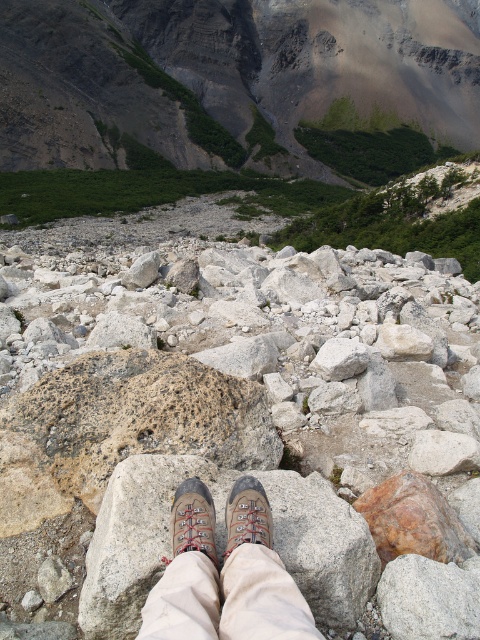
Based on the photo, you are a hiker trying to decide which footwear to wear for the rocky terrain ahead. You have two options in the image, the brown leather boots at center and the brown suede shoe at center. Based on their placement in the scene, which one is positioned to the right?

The brown leather boots at center are to the right of the brown suede shoe at center, so the brown leather boots at center is positioned to the right.

You are a hiker trying to take a photo of the rugged granite mountain at upper center. However, your brown suede shoe at center is blocking the view. Can you move your foot to the left to get a clear shot?

The brown suede shoe at center is behind the rugged granite mountain at upper center, so moving your foot to the left might not help because the shoe is already positioned behind the mountain. You might need to move your foot to the right to ensure it doesn not obstruct the view.

You are a hiker who wants to place your brown suede shoe at center on top of the speckled rock at center. Based on their sizes, will the shoe fit stably on the rock?

The speckled rock at center has a greater height compared to brown suede shoe at center. Since the rock is taller, the shoe can be placed stably on top as long as the base of the rock is wide enough to support it.